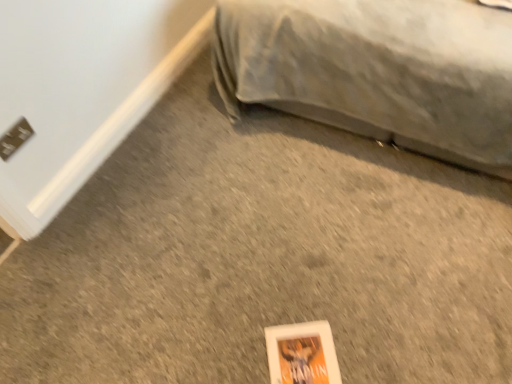
I want to click on free spot below white matte paperback book at lower center (from a real-world perspective), so click(296, 357).